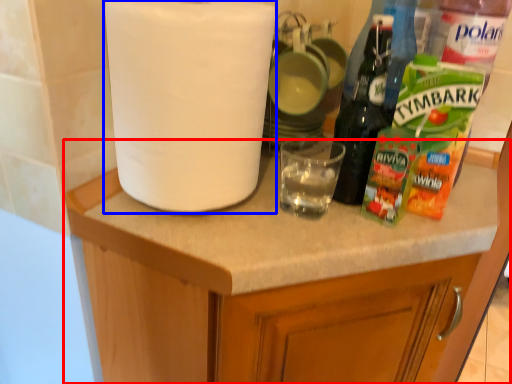
Question: Which object is further to the camera taking this photo, cabinetry (highlighted by a red box) or paper towel (highlighted by a blue box)?

Choices:
 (A) cabinetry
 (B) paper towel

Answer: (B)